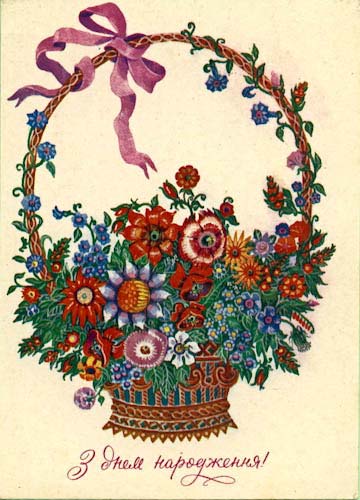
What are the coordinates of `basket handle` in the screenshot? It's located at (31, 177), (310, 194).